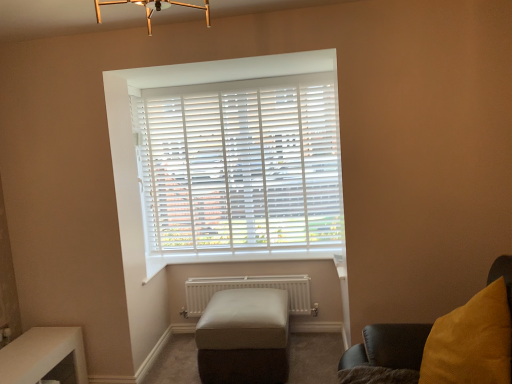
Question: Is white glossy table at lower left far from white matte radiator at lower center?

Choices:
 (A) yes
 (B) no

Answer: (A)

Question: Considering the relative sizes of white glossy table at lower left and white matte radiator at lower center in the image provided, is white glossy table at lower left bigger than white matte radiator at lower center?

Choices:
 (A) yes
 (B) no

Answer: (A)

Question: Is white glossy table at lower left positioned with its back to white matte radiator at lower center?

Choices:
 (A) no
 (B) yes

Answer: (A)

Question: Does white glossy table at lower left have a lesser height compared to white matte radiator at lower center?

Choices:
 (A) yes
 (B) no

Answer: (B)

Question: Considering the relative sizes of white glossy table at lower left and white matte radiator at lower center in the image provided, is white glossy table at lower left smaller than white matte radiator at lower center?

Choices:
 (A) yes
 (B) no

Answer: (B)

Question: Is white glossy table at lower left in contact with white matte radiator at lower center?

Choices:
 (A) yes
 (B) no

Answer: (B)

Question: From a real-world perspective, is white glossy table at lower left located beneath velvet yellow cushion at right?

Choices:
 (A) no
 (B) yes

Answer: (B)

Question: Considering the relative sizes of white glossy table at lower left and velvet yellow cushion at right in the image provided, is white glossy table at lower left thinner than velvet yellow cushion at right?

Choices:
 (A) yes
 (B) no

Answer: (A)

Question: Does white glossy table at lower left have a larger size compared to velvet yellow cushion at right?

Choices:
 (A) no
 (B) yes

Answer: (A)

Question: Can velvet yellow cushion at right be found inside white glossy table at lower left?

Choices:
 (A) yes
 (B) no

Answer: (B)

Question: From the image's perspective, is white glossy table at lower left located beneath velvet yellow cushion at right?

Choices:
 (A) no
 (B) yes

Answer: (B)

Question: Is the surface of white glossy table at lower left in direct contact with velvet yellow cushion at right?

Choices:
 (A) no
 (B) yes

Answer: (A)

Question: Does white plastic blinds at center contain white matte radiator at lower center?

Choices:
 (A) no
 (B) yes

Answer: (A)